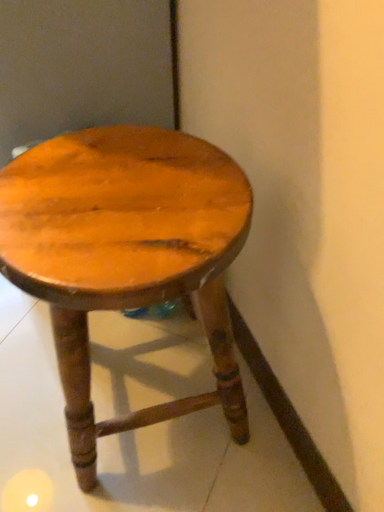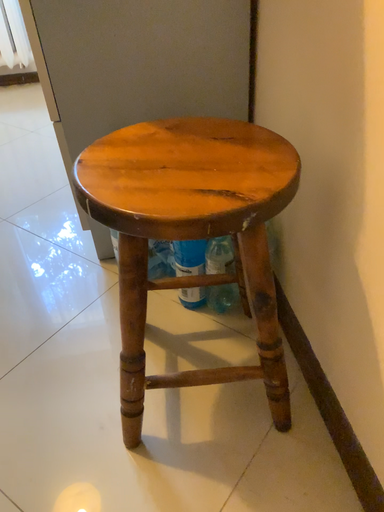
Question: Which way did the camera rotate in the video?

Choices:
 (A) rotated left
 (B) rotated right

Answer: (A)